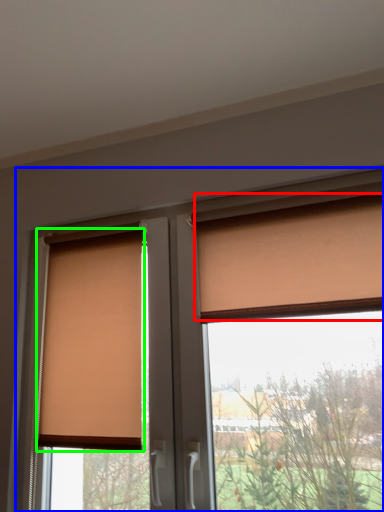
Question: Estimate the real-world distances between objects in this image. Which object is closer to curtain (highlighted by a red box), window (highlighted by a blue box) or window blind (highlighted by a green box)?

Choices:
 (A) window
 (B) window blind

Answer: (A)